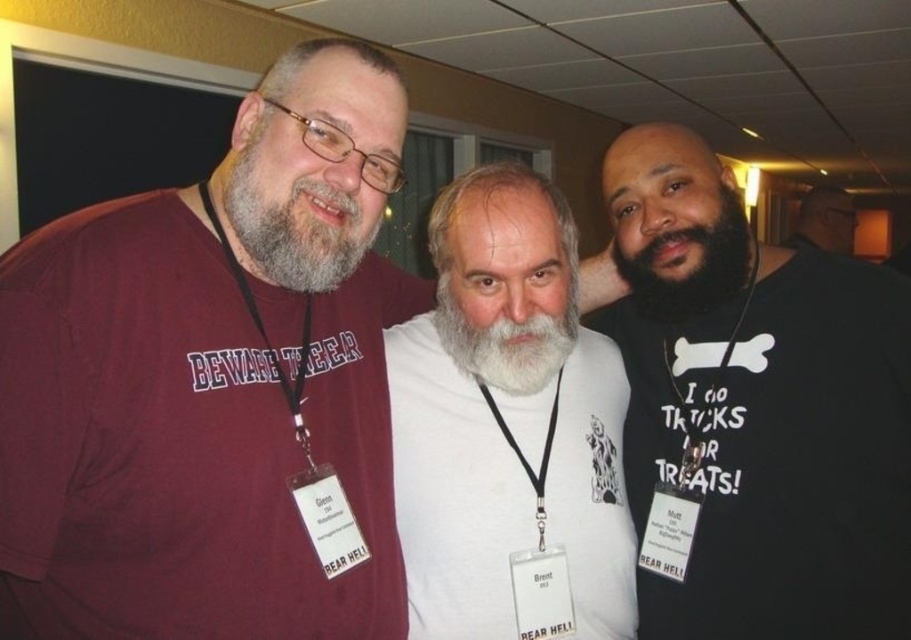
Question: Which object is the closest to the maroon cotton t-shirt at left?

Choices:
 (A) graysoftbeard at left
 (B) white matte t-shirt at center
 (C) whitesoftbeard at center
 (D) black matte t-shirt at center

Answer: (A)

Question: Which of the following is the closest to the observer?

Choices:
 (A) whitesoftbeard at center
 (B) black fuzzy beard at center
 (C) graysoftbeard at left

Answer: (C)

Question: Does maroon cotton t-shirt at left lie in front of black matte t-shirt at center?

Choices:
 (A) no
 (B) yes

Answer: (B)

Question: Can you confirm if black matte t-shirt at center is positioned above black matte shirt at center?

Choices:
 (A) no
 (B) yes

Answer: (A)

Question: Can you confirm if maroon cotton t-shirt at left is wider than black matte shirt at center?

Choices:
 (A) no
 (B) yes

Answer: (A)

Question: Which point is farther to the camera?

Choices:
 (A) (514, 344)
 (B) (850, 241)

Answer: (B)